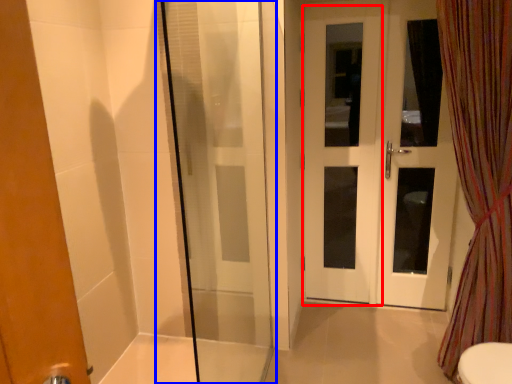
Question: Which object appears closest to the camera in this image, screen door (highlighted by a red box) or shower door (highlighted by a blue box)?

Choices:
 (A) screen door
 (B) shower door

Answer: (B)